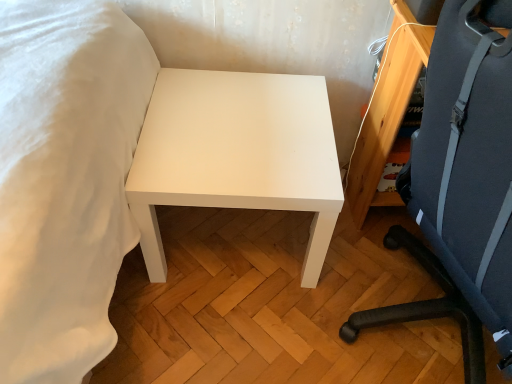
Question: Considering the relative sizes of white matte table at center and dark blue fabric chair at right in the image provided, is white matte table at center shorter than dark blue fabric chair at right?

Choices:
 (A) yes
 (B) no

Answer: (A)

Question: Can dark blue fabric chair at right be found inside white matte table at center?

Choices:
 (A) no
 (B) yes

Answer: (A)

Question: Is the depth of white matte table at center greater than that of dark blue fabric chair at right?

Choices:
 (A) yes
 (B) no

Answer: (A)

Question: From a real-world perspective, is white matte table at center beneath dark blue fabric chair at right?

Choices:
 (A) no
 (B) yes

Answer: (B)

Question: Can you confirm if white matte table at center is positioned to the right of dark blue fabric chair at right?

Choices:
 (A) yes
 (B) no

Answer: (B)

Question: From a real-world perspective, is white matte table at center positioned over dark blue fabric chair at right based on gravity?

Choices:
 (A) yes
 (B) no

Answer: (B)

Question: Considering the relative sizes of dark blue fabric chair at right and white matte table at center in the image provided, is dark blue fabric chair at right wider than white matte table at center?

Choices:
 (A) no
 (B) yes

Answer: (B)

Question: Does dark blue fabric chair at right have a lesser width compared to white matte table at center?

Choices:
 (A) no
 (B) yes

Answer: (A)

Question: Is dark blue fabric chair at right with white matte table at center?

Choices:
 (A) yes
 (B) no

Answer: (B)

Question: From the image's perspective, is dark blue fabric chair at right below white matte table at center?

Choices:
 (A) yes
 (B) no

Answer: (A)

Question: Can you confirm if dark blue fabric chair at right is smaller than white matte table at center?

Choices:
 (A) no
 (B) yes

Answer: (A)

Question: Is there a large distance between dark blue fabric chair at right and white matte table at center?

Choices:
 (A) no
 (B) yes

Answer: (A)

Question: Which is correct: white matte table at center is inside dark blue fabric chair at right, or outside of it?

Choices:
 (A) outside
 (B) inside

Answer: (A)